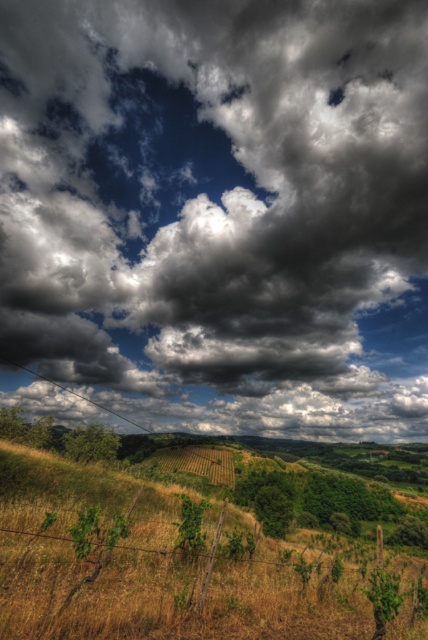
You are standing in the vineyard and looking up at the sky. Which object is closer to you, the dark gray cloud at upper center or the green grassy field at center?

The dark gray cloud at upper center is closer to you because it is positioned further to the viewer than the green grassy field at center.

You are standing in the vineyard and want to determine which object in the scene is taller. Based on the image, which is taller between the dark gray cloud at upper center and the green grassy field at center?

The dark gray cloud at upper center is taller than the green grassy field at center according to the description.